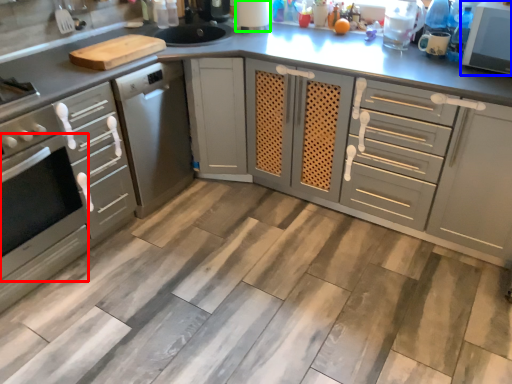
Question: Estimate the real-world distances between objects in this image. Which object is closer to oven (highlighted by a red box), home appliance (highlighted by a blue box) or appliance (highlighted by a green box)?

Choices:
 (A) home appliance
 (B) appliance

Answer: (B)